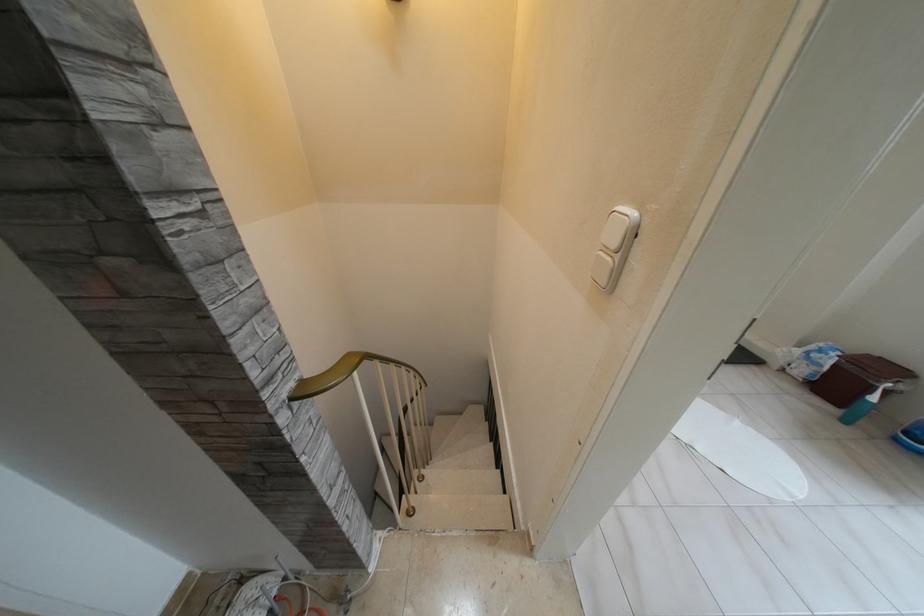
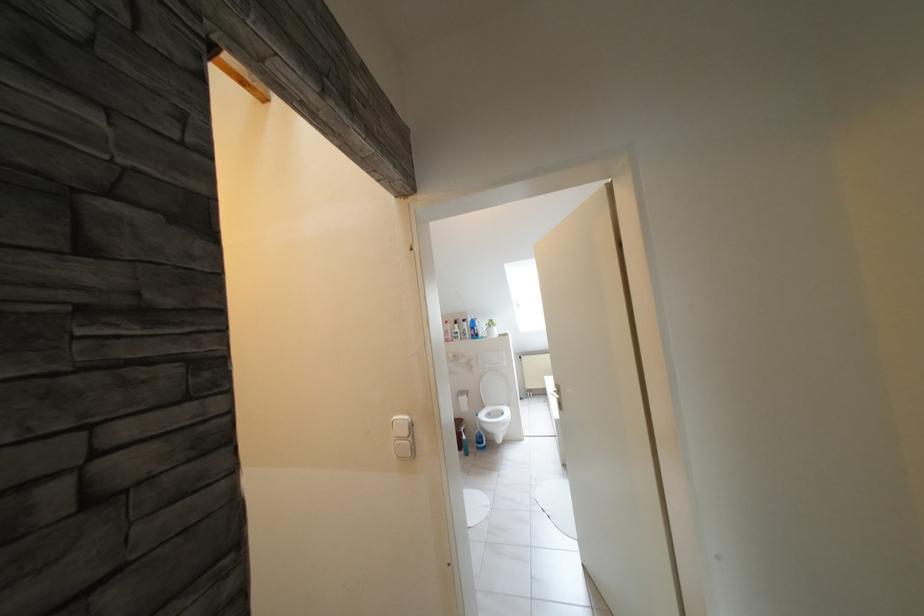
Question: Based on the continuous images, in which direction is the camera rotating? Reply with the corresponding letter.

Choices:
 (A) Left
 (B) Right
 (C) Up
 (D) Down

Answer: (B)